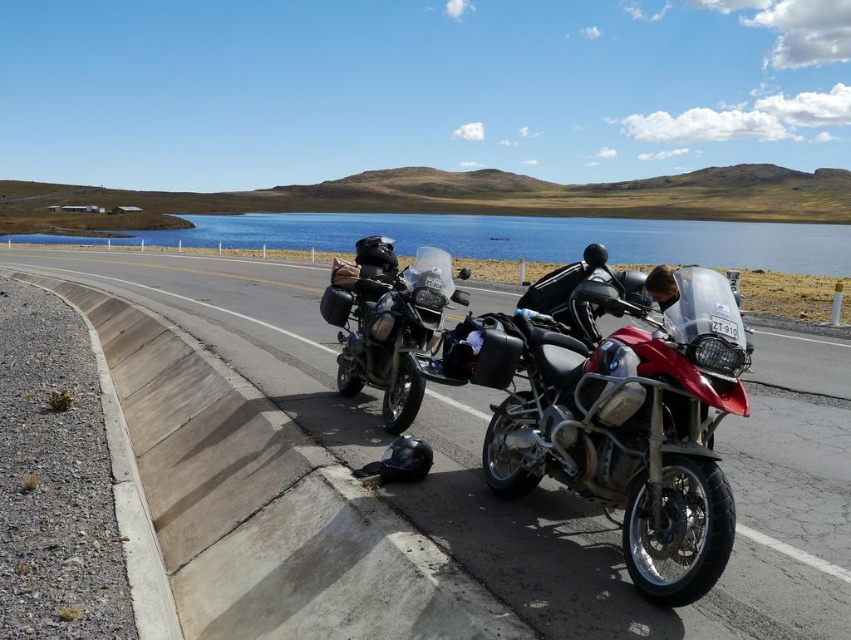
Which is behind, point (798, 570) or point (692, 408)?

Positioned behind is point (798, 570).

Which of these two, asphalt road at center or metallic silver motorcycle at center, stands shorter?

With less height is metallic silver motorcycle at center.

Looking at this image, who is more distant from viewer, (780, 552) or (704, 320)?

Positioned behind is point (780, 552).

This screenshot has width=851, height=640. In order to click on asphalt road at center in this screenshot , I will do `click(618, 532)`.

Does metallic silver motorcycle at center have a greater height compared to matte black motorcycle at center?

Yes, metallic silver motorcycle at center is taller than matte black motorcycle at center.

Is point (581, 378) in front of point (363, 326)?

Yes, point (581, 378) is closer to viewer.

I want to click on metallic silver motorcycle at center, so click(x=627, y=424).

Can you confirm if asphalt road at center is taller than matte black motorcycle at center?

Indeed, asphalt road at center has a greater height compared to matte black motorcycle at center.

Can you confirm if asphalt road at center is positioned to the right of matte black motorcycle at center?

In fact, asphalt road at center is to the left of matte black motorcycle at center.

Find the location of `asphalt road at center`. asphalt road at center is located at coordinates (618, 532).